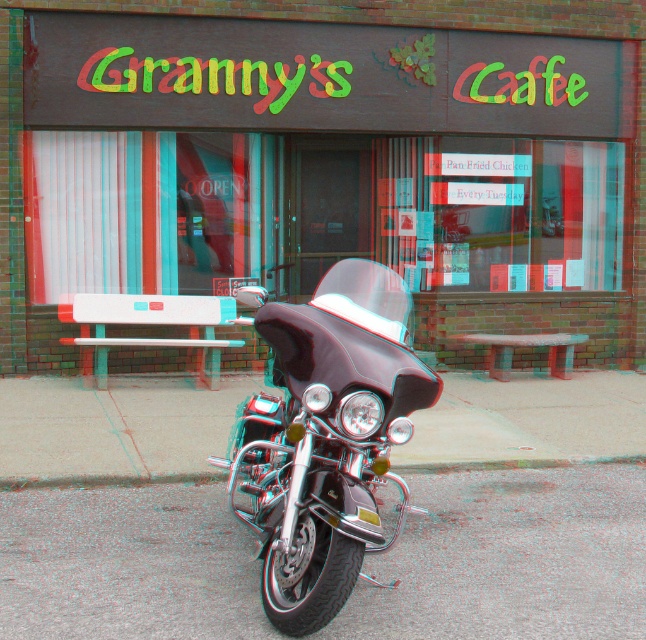
Question: Is brick wall at center in front of shiny chrome motorbike at center?

Choices:
 (A) no
 (B) yes

Answer: (A)

Question: Does brick wall at center have a larger size compared to shiny chrome motorbike at center?

Choices:
 (A) no
 (B) yes

Answer: (A)

Question: Considering the relative positions of brick wall at center and shiny chrome motorbike at center in the image provided, where is brick wall at center located with respect to shiny chrome motorbike at center?

Choices:
 (A) right
 (B) left

Answer: (A)